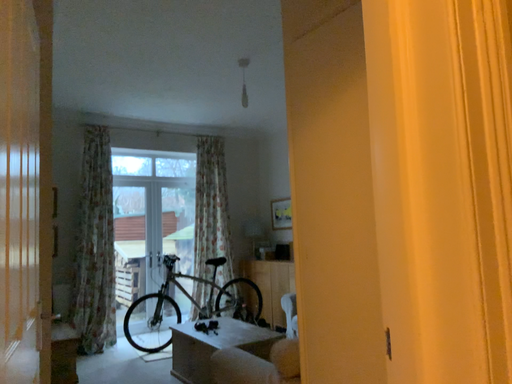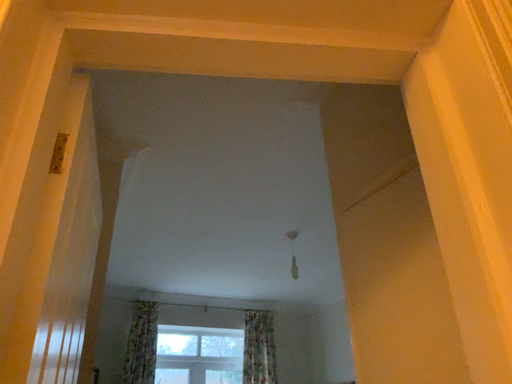
Question: How did the camera likely rotate when shooting the video?

Choices:
 (A) rotated upward
 (B) rotated downward

Answer: (A)